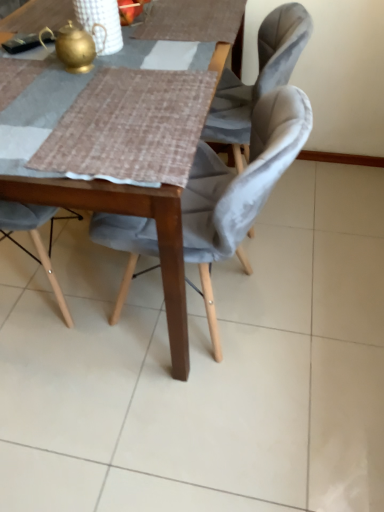
The width and height of the screenshot is (384, 512). Find the location of `vacant area located to the right-hand side of gold metallic teapot at upper left`. vacant area located to the right-hand side of gold metallic teapot at upper left is located at coordinates (147, 66).